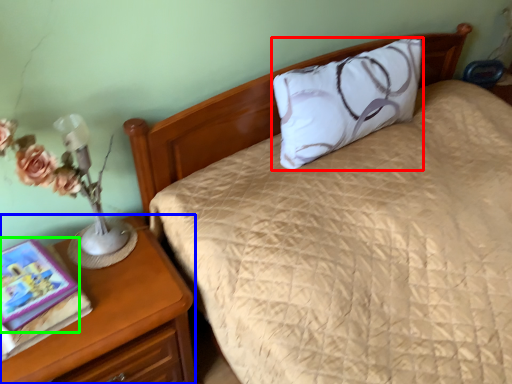
Question: Which object is the farthest from pillow (highlighted by a red box)? Choose among these: nightstand (highlighted by a blue box) or book (highlighted by a green box).

Choices:
 (A) nightstand
 (B) book

Answer: (B)